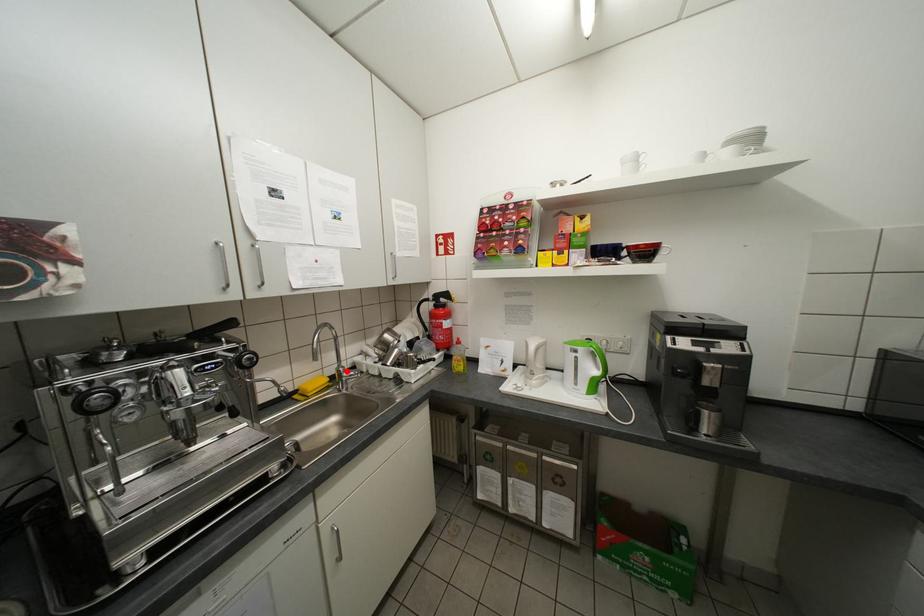
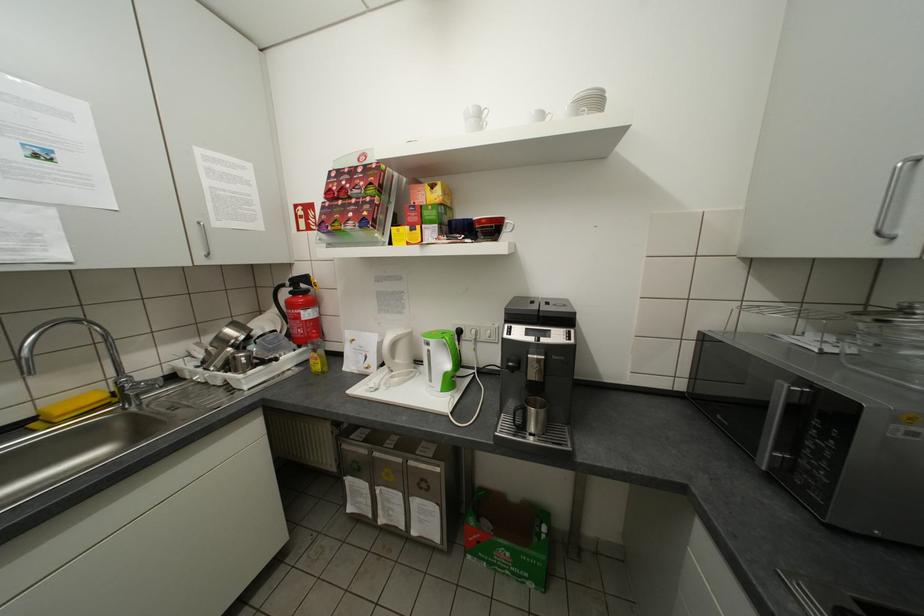
In the second image, find the point that corresponds to the highlighted location in the first image.

(126, 383)